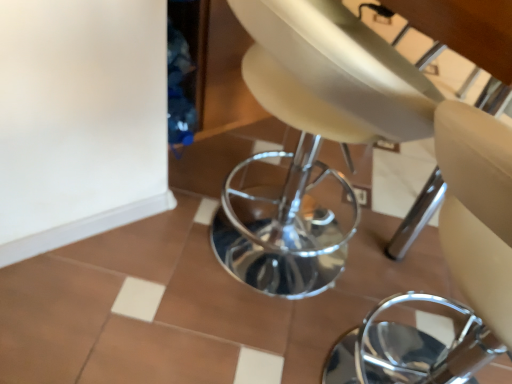
Find the location of `vacant space to the right of white glossy tile at lower left`. vacant space to the right of white glossy tile at lower left is located at coordinates (175, 256).